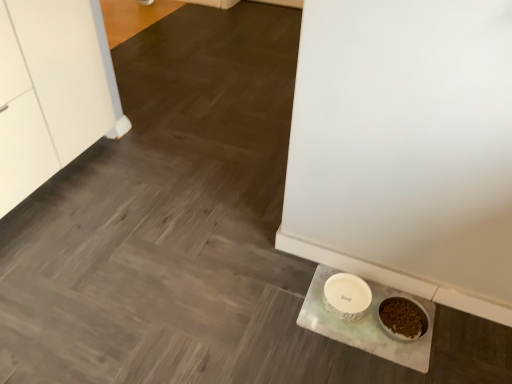
The height and width of the screenshot is (384, 512). Describe the element at coordinates (346, 296) in the screenshot. I see `white speckled ceramic bowl at lower right` at that location.

This screenshot has height=384, width=512. Identify the location of white speckled ceramic bowl at lower right. (346, 296).

You are a GUI agent. You are given a task and a screenshot of the screen. Output one action in this format:
    pyautogui.click(x=<x>, y=<y>)
    Task: Click on the white marble slate at lower right
    The height and width of the screenshot is (384, 512).
    Given the screenshot: What is the action you would take?
    pyautogui.click(x=367, y=324)

Image resolution: width=512 pixels, height=384 pixels. What do you see at coordinates (367, 324) in the screenshot?
I see `white marble slate at lower right` at bounding box center [367, 324].

Where is `white speckled ceramic bowl at lower right`? Image resolution: width=512 pixels, height=384 pixels. white speckled ceramic bowl at lower right is located at coordinates (346, 296).

Is white speckled ceramic bowl at lower right to the left of white marble slate at lower right from the viewer's perspective?

Indeed, white speckled ceramic bowl at lower right is positioned on the left side of white marble slate at lower right.

Does white speckled ceramic bowl at lower right come in front of white marble slate at lower right?

No, the depth of white speckled ceramic bowl at lower right is greater than that of white marble slate at lower right.

Does point (325, 285) appear closer or farther from the camera than point (298, 323)?

Point (325, 285) is farther from the camera than point (298, 323).

From the image's perspective, relative to white marble slate at lower right, is white speckled ceramic bowl at lower right above or below?

From the image's perspective, white speckled ceramic bowl at lower right appears above white marble slate at lower right.

From a real-world perspective, is white speckled ceramic bowl at lower right beneath white marble slate at lower right?

No, from a real-world perspective, white speckled ceramic bowl at lower right is not below white marble slate at lower right.

Considering the relative sizes of white speckled ceramic bowl at lower right and white marble slate at lower right in the image provided, is white speckled ceramic bowl at lower right wider than white marble slate at lower right?

No.

Which of these two, white speckled ceramic bowl at lower right or white marble slate at lower right, stands shorter?

white marble slate at lower right is shorter.

Which of these two, white speckled ceramic bowl at lower right or white marble slate at lower right, is smaller?

Smaller between the two is white speckled ceramic bowl at lower right.

Can we say white speckled ceramic bowl at lower right lies outside white marble slate at lower right?

Yes, white speckled ceramic bowl at lower right is not within white marble slate at lower right.

Are white speckled ceramic bowl at lower right and white marble slate at lower right located far from each other?

No, white speckled ceramic bowl at lower right is not far away from white marble slate at lower right.

Is white speckled ceramic bowl at lower right oriented towards white marble slate at lower right?

No, white speckled ceramic bowl at lower right is not aimed at white marble slate at lower right.

Looking at this image, how different are the orientations of white speckled ceramic bowl at lower right and white marble slate at lower right in degrees?

The facing directions of white speckled ceramic bowl at lower right and white marble slate at lower right are 0.00217 degrees apart.

Locate an element on the screen. bowl to the left of white marble slate at lower right is located at coordinates (346, 296).

Considering the positions of objects white marble slate at lower right and white speckled ceramic bowl at lower right in the image provided, who is more to the right, white marble slate at lower right or white speckled ceramic bowl at lower right?

white marble slate at lower right is more to the right.

Considering their positions, is white marble slate at lower right located in front of or behind white speckled ceramic bowl at lower right?

white marble slate at lower right is in front of white speckled ceramic bowl at lower right.

Is point (399, 352) more distant than point (356, 285)?

No.

Based on the photo, from the image's perspective, who appears lower, white marble slate at lower right or white speckled ceramic bowl at lower right?

From the image's view, white marble slate at lower right is below.

From a real-world perspective, is white marble slate at lower right physically located above or below white speckled ceramic bowl at lower right?

white marble slate at lower right is below white speckled ceramic bowl at lower right.

Which object is thinner, white marble slate at lower right or white speckled ceramic bowl at lower right?

Thinner between the two is white speckled ceramic bowl at lower right.

Consider the image. Can you confirm if white marble slate at lower right is taller than white speckled ceramic bowl at lower right?

No, white marble slate at lower right is not taller than white speckled ceramic bowl at lower right.

Considering the relative sizes of white marble slate at lower right and white speckled ceramic bowl at lower right in the image provided, is white marble slate at lower right bigger than white speckled ceramic bowl at lower right?

Yes, white marble slate at lower right is bigger than white speckled ceramic bowl at lower right.

Is white marble slate at lower right completely or partially outside of white speckled ceramic bowl at lower right?

Yes, white marble slate at lower right is located beyond the bounds of white speckled ceramic bowl at lower right.

Are white marble slate at lower right and white speckled ceramic bowl at lower right far apart?

No.

Is white marble slate at lower right oriented towards white speckled ceramic bowl at lower right?

No, white marble slate at lower right is not oriented towards white speckled ceramic bowl at lower right.

Measure the distance between white marble slate at lower right and white speckled ceramic bowl at lower right.

white marble slate at lower right is 8.41 centimeters from white speckled ceramic bowl at lower right.

This screenshot has height=384, width=512. In order to click on bowl behind the white marble slate at lower right in this screenshot , I will do `click(346, 296)`.

Locate an element on the screen. slate in front of the white speckled ceramic bowl at lower right is located at coordinates (367, 324).

At what (x,y) coordinates should I click in order to perform the action: click on slate below the white speckled ceramic bowl at lower right (from a real-world perspective). Please return your answer as a coordinate pair (x, y). This screenshot has width=512, height=384. Looking at the image, I should click on (367, 324).